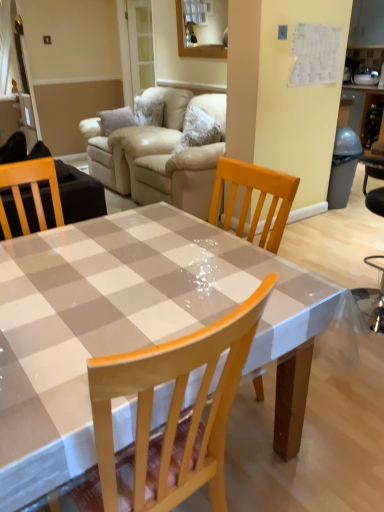
Question: From a real-world perspective, is beige leather couch at upper center beneath clear plastic table at center?

Choices:
 (A) yes
 (B) no

Answer: (B)

Question: From a real-world perspective, is beige leather couch at upper center over clear plastic table at center?

Choices:
 (A) yes
 (B) no

Answer: (A)

Question: From the image's perspective, does beige leather couch at upper center appear lower than clear plastic table at center?

Choices:
 (A) yes
 (B) no

Answer: (B)

Question: Is beige leather couch at upper center in contact with clear plastic table at center?

Choices:
 (A) yes
 (B) no

Answer: (B)

Question: Is clear plastic table at center located within beige leather couch at upper center?

Choices:
 (A) no
 (B) yes

Answer: (A)

Question: Does beige leather couch at upper center have a smaller size compared to clear plastic table at center?

Choices:
 (A) no
 (B) yes

Answer: (A)

Question: Can you confirm if clear plastic table at center is bigger than beige leather couch at upper center?

Choices:
 (A) yes
 (B) no

Answer: (B)

Question: From the image's perspective, is clear plastic table at center located beneath beige leather couch at upper center?

Choices:
 (A) yes
 (B) no

Answer: (A)

Question: Is the depth of clear plastic table at center less than that of beige leather couch at upper center?

Choices:
 (A) yes
 (B) no

Answer: (A)

Question: Is clear plastic table at center thinner than beige leather couch at upper center?

Choices:
 (A) yes
 (B) no

Answer: (B)

Question: Is clear plastic table at center not close to beige leather couch at upper center?

Choices:
 (A) yes
 (B) no

Answer: (A)

Question: Can you confirm if clear plastic table at center is taller than beige leather couch at upper center?

Choices:
 (A) yes
 (B) no

Answer: (B)

Question: Looking at their shapes, would you say beige leather couch at upper center is wider or thinner than clear plastic table at center?

Choices:
 (A) wide
 (B) thin

Answer: (B)